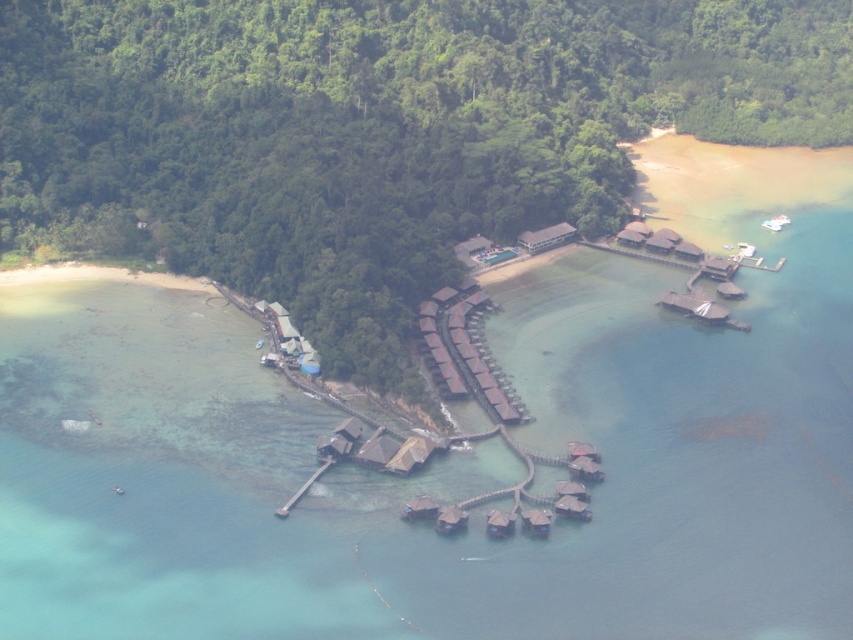
Question: Is brown wooden hut at center to the left of wooden dock at lower center from the viewer's perspective?

Choices:
 (A) no
 (B) yes

Answer: (A)

Question: Is brown wooden hut at center in front of wooden dock at lower center?

Choices:
 (A) no
 (B) yes

Answer: (A)

Question: Is brown wooden hut at center to the right of wooden dock at lower center from the viewer's perspective?

Choices:
 (A) no
 (B) yes

Answer: (B)

Question: Which point appears closest to the camera in this image?

Choices:
 (A) (302, 490)
 (B) (532, 237)

Answer: (A)